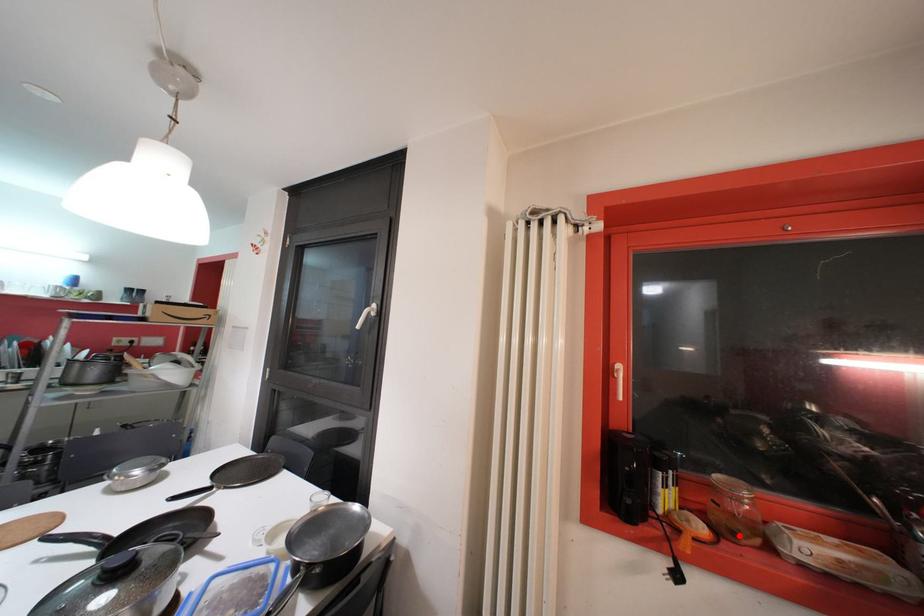
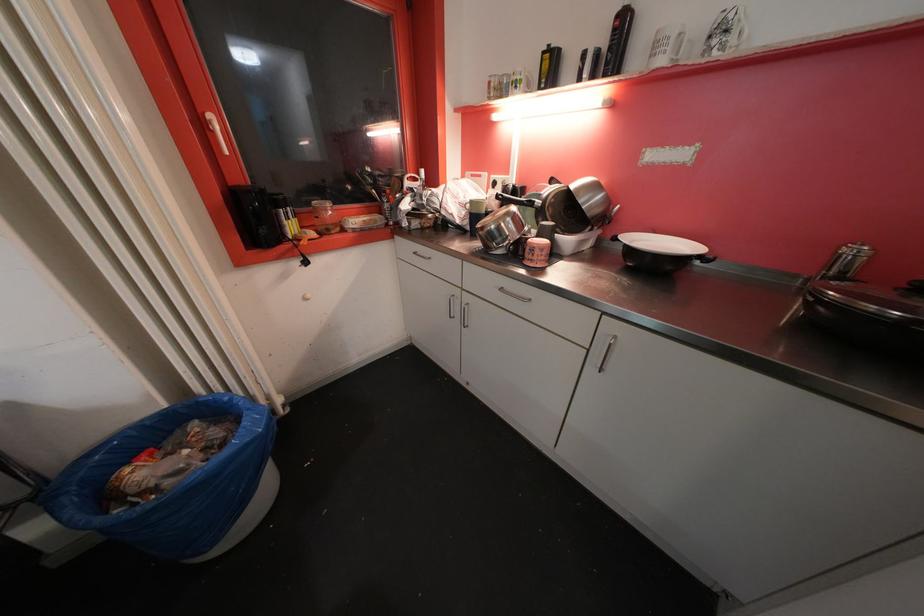
Where in the second image is the point corresponding to the highlighted location from the first image?

(333, 233)